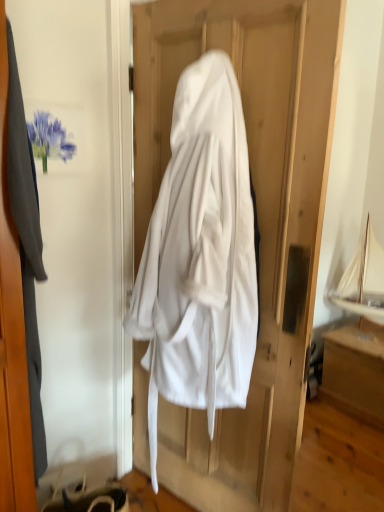
Question: From the image's perspective, is matte gray coat at left positioned above or below gray fabric screen door at left?

Choices:
 (A) above
 (B) below

Answer: (B)

Question: Is matte gray coat at left bigger or smaller than gray fabric screen door at left?

Choices:
 (A) big
 (B) small

Answer: (B)

Question: Estimate the real-world distances between objects in this image. Which object is farther from the white cloth at center?

Choices:
 (A) wooden drawer at lower right
 (B) gray fabric screen door at left
 (C) matte gray coat at left
 (D) white fabric hanger at lower left

Answer: (A)

Question: Which object is positioned farthest from the gray fabric screen door at left?

Choices:
 (A) white fabric hanger at lower left
 (B) wooden drawer at lower right
 (C) white cloth at center
 (D) matte gray coat at left

Answer: (B)